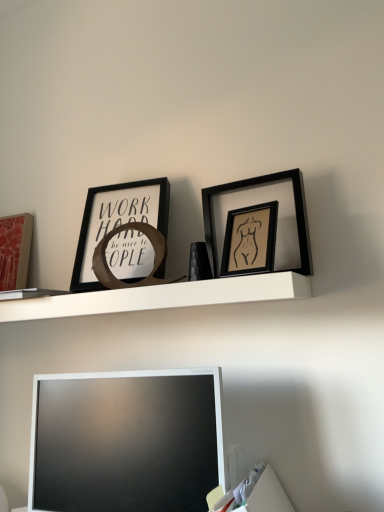
Question: From a real-world perspective, is white matte shelf at upper center located higher than matte pink picture frame at left, which is counted as the first picture frame, starting from the left?

Choices:
 (A) no
 (B) yes

Answer: (A)

Question: Are white matte shelf at upper center and matte pink picture frame at left, which is counted as the first picture frame, starting from the left, located far from each other?

Choices:
 (A) no
 (B) yes

Answer: (A)

Question: Is white matte shelf at upper center positioned with its back to matte pink picture frame at left, which is counted as the first picture frame, starting from the left?

Choices:
 (A) no
 (B) yes

Answer: (A)

Question: Is white matte shelf at upper center completely or partially outside of matte pink picture frame at left, which ranks as the fourth picture frame in right-to-left order?

Choices:
 (A) no
 (B) yes

Answer: (B)

Question: Can you confirm if white matte shelf at upper center is positioned to the right of matte pink picture frame at left, the 1th picture frame viewed from the back?

Choices:
 (A) no
 (B) yes

Answer: (B)

Question: Is white matte shelf at upper center smaller than matte pink picture frame at left, the 1th picture frame viewed from the back?

Choices:
 (A) no
 (B) yes

Answer: (A)

Question: Is black matte picture frame at upper right, acting as the 2th picture frame starting from the front, located outside white glossy television at lower center?

Choices:
 (A) no
 (B) yes

Answer: (B)

Question: Can you confirm if black matte picture frame at upper right, placed as the 4th picture frame when sorted from left to right, is shorter than white glossy television at lower center?

Choices:
 (A) yes
 (B) no

Answer: (A)

Question: Can you confirm if black matte picture frame at upper right, acting as the 2th picture frame starting from the front, is taller than white glossy television at lower center?

Choices:
 (A) yes
 (B) no

Answer: (B)

Question: Is black matte picture frame at upper right, acting as the 2th picture frame starting from the front, further to camera compared to white glossy television at lower center?

Choices:
 (A) yes
 (B) no

Answer: (A)

Question: Does black matte picture frame at upper right, positioned as the first picture frame in right-to-left order, have a lesser width compared to white glossy television at lower center?

Choices:
 (A) no
 (B) yes

Answer: (B)

Question: Considering the relative positions of black matte picture frame at upper right, which ranks as the 3th picture frame in back-to-front order, and white glossy television at lower center in the image provided, is black matte picture frame at upper right, which ranks as the 3th picture frame in back-to-front order, to the right of white glossy television at lower center from the viewer's perspective?

Choices:
 (A) no
 (B) yes

Answer: (B)

Question: Can you confirm if matte pink picture frame at left, which ranks as the fourth picture frame in right-to-left order, is wider than white glossy television at lower center?

Choices:
 (A) yes
 (B) no

Answer: (B)